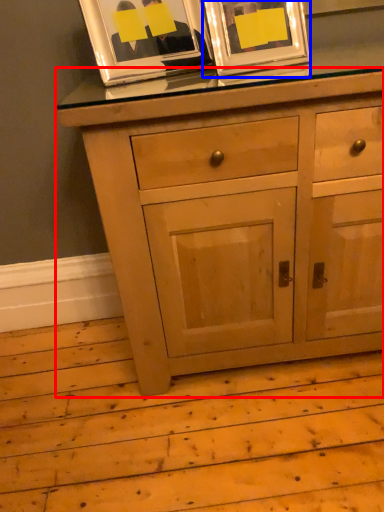
Question: Which object is further to the camera taking this photo, chest of drawers (highlighted by a red box) or picture frame (highlighted by a blue box)?

Choices:
 (A) chest of drawers
 (B) picture frame

Answer: (B)